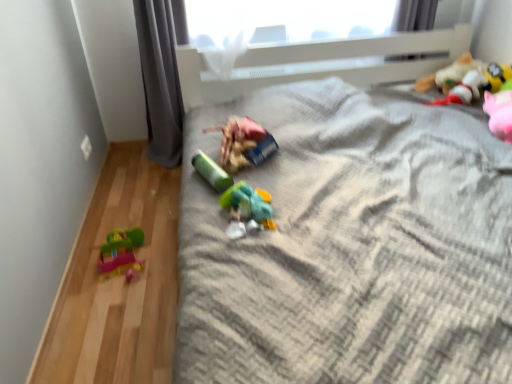
Question: From the image's perspective, is translucent plastic toy at center, positioned as the third toy in right-to-left order, under plastic toy car at left, the first toy from the left?

Choices:
 (A) no
 (B) yes

Answer: (A)

Question: Can you confirm if translucent plastic toy at center, positioned as the third toy in right-to-left order, is taller than plastic toy car at left, which is counted as the 6th toy, starting from the right?

Choices:
 (A) yes
 (B) no

Answer: (B)

Question: From a real-world perspective, is translucent plastic toy at center, positioned as the third toy in right-to-left order, physically above plastic toy car at left, which is counted as the 6th toy, starting from the right?

Choices:
 (A) yes
 (B) no

Answer: (A)

Question: Considering the relative sizes of translucent plastic toy at center, which is the fourth toy from left to right, and plastic toy car at left, the first toy from the left, in the image provided, is translucent plastic toy at center, which is the fourth toy from left to right, smaller than plastic toy car at left, the first toy from the left,?

Choices:
 (A) no
 (B) yes

Answer: (B)

Question: Can you confirm if translucent plastic toy at center, positioned as the third toy in right-to-left order, is thinner than plastic toy car at left, which is counted as the 6th toy, starting from the right?

Choices:
 (A) no
 (B) yes

Answer: (A)

Question: Considering the relative positions of translucent plastic toy at center, positioned as the third toy in right-to-left order, and plush yellow toy at upper right, arranged as the 1th toy when viewed from the right, in the image provided, is translucent plastic toy at center, positioned as the third toy in right-to-left order, to the left or to the right of plush yellow toy at upper right, arranged as the 1th toy when viewed from the right,?

Choices:
 (A) right
 (B) left

Answer: (B)

Question: Based on their sizes in the image, would you say translucent plastic toy at center, which is the fourth toy from left to right, is bigger or smaller than plush yellow toy at upper right, the 6th toy when ordered from left to right?

Choices:
 (A) big
 (B) small

Answer: (B)

Question: Considering the positions of point (252, 205) and point (493, 86), is point (252, 205) closer or farther from the camera than point (493, 86)?

Choices:
 (A) farther
 (B) closer

Answer: (B)

Question: From the image's perspective, is translucent plastic toy at center, positioned as the third toy in right-to-left order, located above or below plush yellow toy at upper right, arranged as the 1th toy when viewed from the right?

Choices:
 (A) below
 (B) above

Answer: (A)

Question: In terms of width, does gray textured blanket at center look wider or thinner when compared to gray fabric curtain at left?

Choices:
 (A) wide
 (B) thin

Answer: (A)

Question: In the image, is gray textured blanket at center positioned in front of or behind gray fabric curtain at left?

Choices:
 (A) front
 (B) behind

Answer: (A)

Question: Is point (243, 312) closer or farther from the camera than point (142, 59)?

Choices:
 (A) closer
 (B) farther

Answer: (A)

Question: Would you say gray textured blanket at center is inside or outside gray fabric curtain at left?

Choices:
 (A) outside
 (B) inside

Answer: (A)

Question: From the image's perspective, is gray textured blanket at center positioned above or below plush yellow toy at upper right, the 6th toy when ordered from left to right?

Choices:
 (A) below
 (B) above

Answer: (A)

Question: Considering the relative positions of gray textured blanket at center and plush yellow toy at upper right, the 6th toy when ordered from left to right, in the image provided, is gray textured blanket at center to the left or to the right of plush yellow toy at upper right, the 6th toy when ordered from left to right,?

Choices:
 (A) left
 (B) right

Answer: (A)